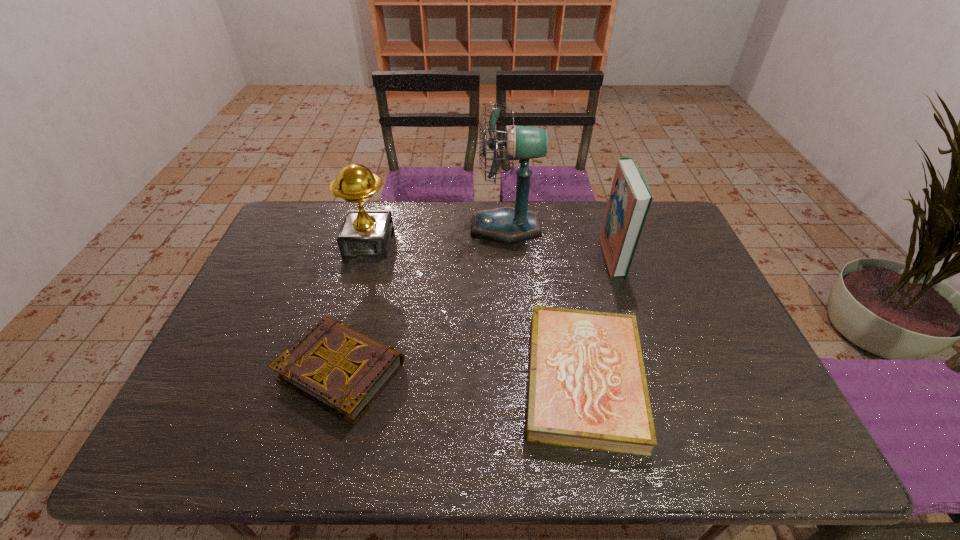
Locate an element on the screen. fan is located at coordinates (506, 224).

Locate an element on the screen. The width and height of the screenshot is (960, 540). the farthest hardback book is located at coordinates (630, 198).

Find the location of a particular element. award is located at coordinates (364, 233).

Where is `the leftmost hardback book`? The width and height of the screenshot is (960, 540). the leftmost hardback book is located at coordinates (343, 370).

The height and width of the screenshot is (540, 960). What are the coordinates of `vacant region located 0.310m in front of the tallest object where the wind blows` in the screenshot? It's located at (381, 227).

This screenshot has width=960, height=540. Identify the location of vacant space located 0.180m in front of the tallest object where the wind blows. (419, 227).

Find the location of a particular element. This screenshot has width=960, height=540. blank area located in front of the tallest object where the wind blows is located at coordinates (450, 227).

Where is `free space located 0.130m on the cover of the tallest hardback book`? This screenshot has width=960, height=540. free space located 0.130m on the cover of the tallest hardback book is located at coordinates (564, 256).

The width and height of the screenshot is (960, 540). I want to click on vacant space located 0.050m on the cover of the tallest hardback book, so click(x=588, y=256).

At what (x,y) coordinates should I click in order to perform the action: click on free space located 0.320m on the cover of the tallest hardback book. Please return your answer as a coordinate pair (x, y). The image size is (960, 540). Looking at the image, I should click on (504, 256).